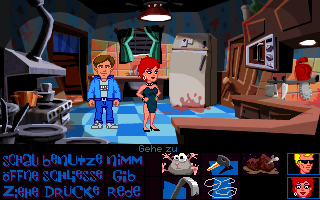
At what (x,y) coordinates should I click in order to perform the action: click on light. Please return your answer as a coordinate pair (x, y). The image size is (320, 200). Looking at the image, I should click on pyautogui.click(x=157, y=16).